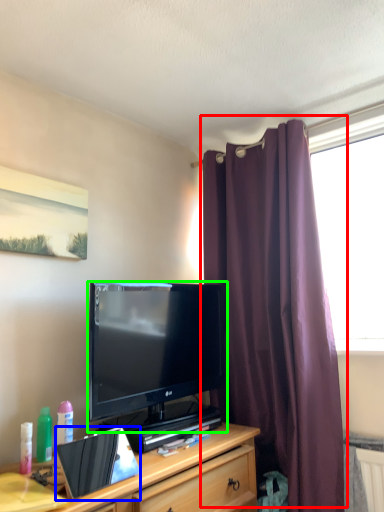
Question: Which is nearer to the curtain (highlighted by a red box)? laptop (highlighted by a blue box) or television (highlighted by a green box).

Choices:
 (A) laptop
 (B) television

Answer: (B)